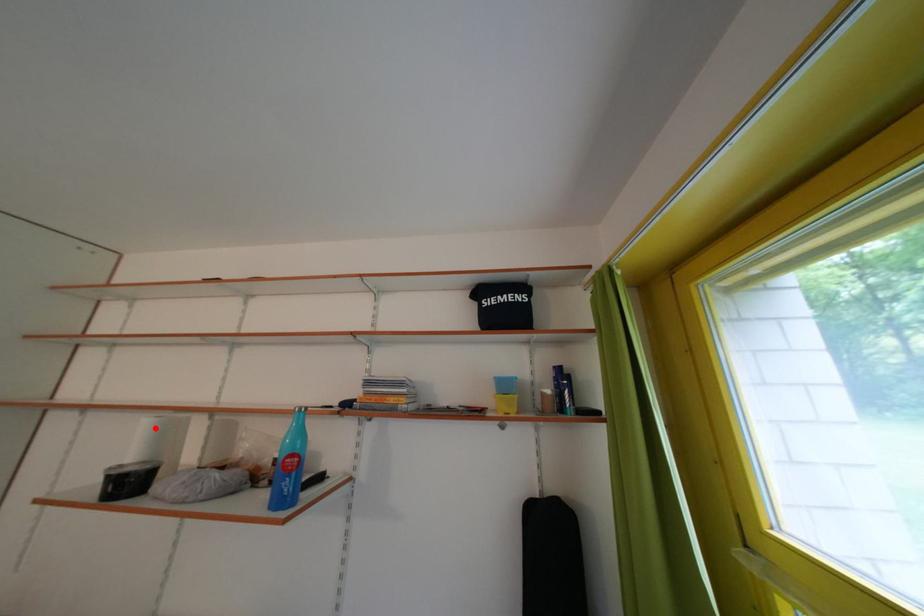
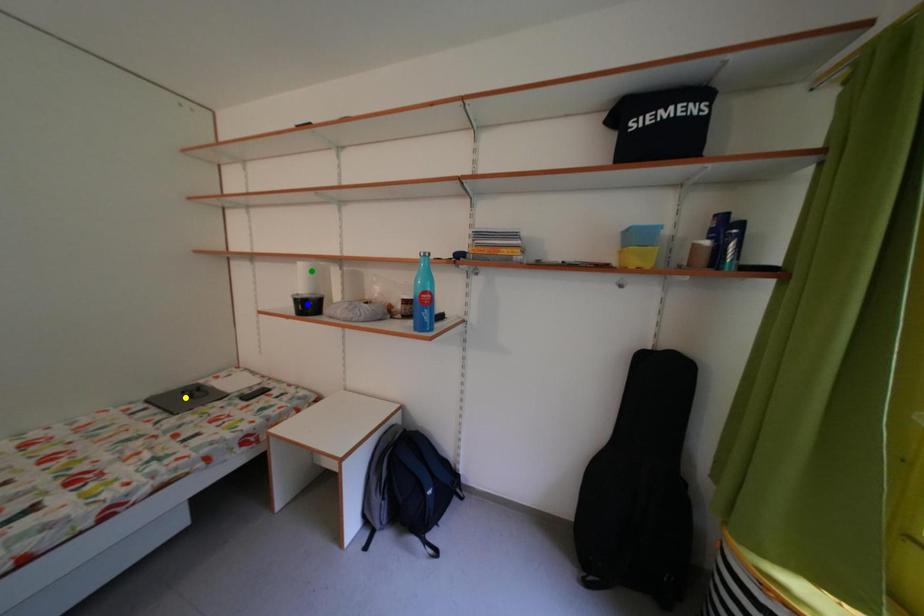
Question: I am providing you with two images of the same scene from different viewpoints. A red point is marked on the first image. You are given multiple points on the second image. Which point in image 2 is actually the same real-world point as the red point in image 1?

Choices:
 (A) yellow point
 (B) green point
 (C) blue point

Answer: (B)